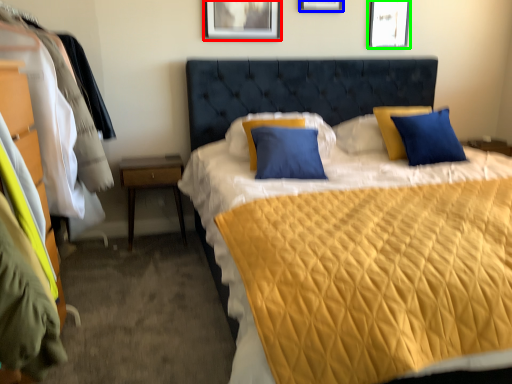
Question: Which is nearer to the picture frame (highlighted by a red box)? picture frame (highlighted by a blue box) or picture frame (highlighted by a green box).

Choices:
 (A) picture frame
 (B) picture frame

Answer: (A)